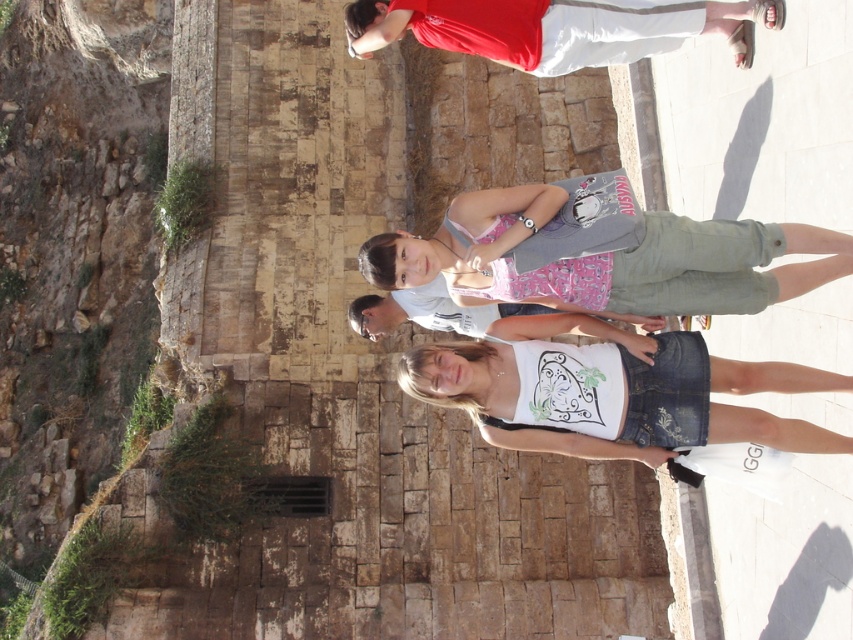
Does matte pink tank top at center appear on the right side of red cotton shirt at upper center?

Yes, matte pink tank top at center is to the right of red cotton shirt at upper center.

Does point (808, 244) come behind point (561, 70)?

No, (808, 244) is closer to viewer.

At what (x,y) coordinates should I click in order to perform the action: click on matte pink tank top at center. Please return your answer as a coordinate pair (x, y). Looking at the image, I should click on (606, 259).

Who is more distant from viewer, [670,340] or [592,29]?

The point [592,29] is more distant.

Measure the distance between white cotton tank top at center and red cotton shirt at upper center.

white cotton tank top at center and red cotton shirt at upper center are 8.92 meters apart.

At what (x,y) coordinates should I click in order to perform the action: click on white cotton tank top at center. Please return your answer as a coordinate pair (x, y). Looking at the image, I should click on (612, 392).

Find the location of a particular element. Image resolution: width=853 pixels, height=640 pixels. white cotton tank top at center is located at coordinates (612, 392).

Is point (549, 3) closer to camera compared to point (650, 320)?

No, it is not.

Is red cotton shirt at upper center smaller than white cotton shirt at center?

Correct, red cotton shirt at upper center occupies less space than white cotton shirt at center.

Does point (683, 19) come closer to viewer compared to point (450, 301)?

Yes, point (683, 19) is closer to viewer.

The image size is (853, 640). In order to click on red cotton shirt at upper center in this screenshot , I will do `click(556, 28)`.